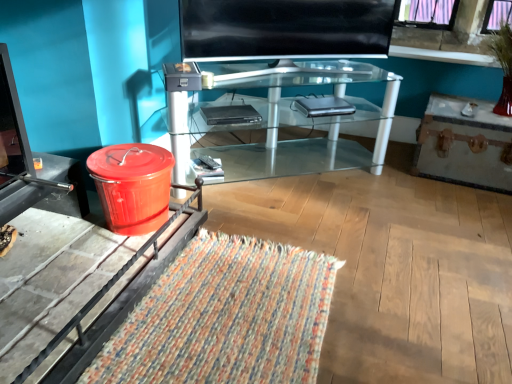
The width and height of the screenshot is (512, 384). I want to click on metallic silver drawer at right, so click(x=464, y=154).

The height and width of the screenshot is (384, 512). What do you see at coordinates (324, 106) in the screenshot?
I see `silver metallic laptop at center, the 2th laptop when ordered from left to right` at bounding box center [324, 106].

Identify the location of silver metallic laptop at center, positioned as the 1th laptop in right-to-left order. (324, 106).

What do you see at coordinates (285, 29) in the screenshot?
I see `black glass screen at center` at bounding box center [285, 29].

What do you see at coordinates (503, 66) in the screenshot?
I see `shiny red vase at upper right` at bounding box center [503, 66].

In order to click on black plastic remote control at center in this screenshot , I will do `click(210, 162)`.

Can you tell me how much shiny plastic trash can at lower left and woven multicolored mat at lower left differ in facing direction?

There is a 0.00157-degree angle between the facing directions of shiny plastic trash can at lower left and woven multicolored mat at lower left.

Does shiny plastic trash can at lower left appear on the right side of woven multicolored mat at lower left?

No.

From a real-world perspective, is shiny plastic trash can at lower left physically above woven multicolored mat at lower left?

Yes.

Is black plastic remote control at center next to black plastic dvd player at center, positioned as the second laptop in right-to-left order, and touching it?

No.

Considering the relative positions of black plastic remote control at center and black plastic dvd player at center, which appears as the first laptop when viewed from the front, in the image provided, is black plastic remote control at center behind black plastic dvd player at center, which appears as the first laptop when viewed from the front,?

Yes, black plastic remote control at center is further from the viewer.

Can you confirm if black plastic remote control at center is taller than black plastic dvd player at center, positioned as the second laptop in right-to-left order?

Incorrect, the height of black plastic remote control at center is not larger of that of black plastic dvd player at center, positioned as the second laptop in right-to-left order.

Considering the relative sizes of black plastic remote control at center and black plastic dvd player at center, positioned as the second laptop in right-to-left order, in the image provided, is black plastic remote control at center bigger than black plastic dvd player at center, positioned as the second laptop in right-to-left order,?

Incorrect, black plastic remote control at center is not larger than black plastic dvd player at center, positioned as the second laptop in right-to-left order.

From a real-world perspective, is shiny red vase at upper right over black glass screen at center?

No, from a real-world perspective, shiny red vase at upper right is not over black glass screen at center

Does shiny red vase at upper right have a smaller size compared to black glass screen at center?

Correct, shiny red vase at upper right occupies less space than black glass screen at center.

Considering the relative sizes of shiny red vase at upper right and black glass screen at center in the image provided, is shiny red vase at upper right wider than black glass screen at center?

Indeed, shiny red vase at upper right has a greater width compared to black glass screen at center.

Can you confirm if shiny red vase at upper right is bigger than black plastic remote control at center?

Yes.

Find the location of a particular element. The height and width of the screenshot is (384, 512). houseplant in front of the black plastic remote control at center is located at coordinates (503, 66).

From a real-world perspective, between shiny red vase at upper right and black plastic remote control at center, who is vertically higher?

In real-world perspective, shiny red vase at upper right is above.

From a real-world perspective, is woven multicolored mat at lower left above or below black plastic remote control at center?

woven multicolored mat at lower left is below black plastic remote control at center.

Is woven multicolored mat at lower left inside the boundaries of black plastic remote control at center, or outside?

woven multicolored mat at lower left is located beyond the bounds of black plastic remote control at center.

Which is more to the left, woven multicolored mat at lower left or black plastic remote control at center?

black plastic remote control at center is more to the left.

Can you confirm if shiny red vase at upper right is smaller than clear glass desk at center?

Indeed, shiny red vase at upper right has a smaller size compared to clear glass desk at center.

Considering the points (490, 36) and (335, 71), which point is behind, point (490, 36) or point (335, 71)?

Point (335, 71)

From a real-world perspective, which is physically below, shiny red vase at upper right or clear glass desk at center?

From a 3D spatial view, clear glass desk at center is below.

Visually, is shiny red vase at upper right positioned to the left or to the right of clear glass desk at center?

Clearly, shiny red vase at upper right is on the right of clear glass desk at center in the image.

Considering the relative positions of black glass screen at center and black plastic dvd player at center, which is the second laptop in back-to-front order, in the image provided, is black glass screen at center to the right of black plastic dvd player at center, which is the second laptop in back-to-front order, from the viewer's perspective?

Indeed, black glass screen at center is positioned on the right side of black plastic dvd player at center, which is the second laptop in back-to-front order.

Looking at this image, can you confirm if black glass screen at center is smaller than black plastic dvd player at center, which appears as the first laptop when viewed from the front?

Incorrect, black glass screen at center is not smaller in size than black plastic dvd player at center, which appears as the first laptop when viewed from the front.

Identify the location of screen that is above the black plastic dvd player at center, which appears as the first laptop when viewed from the front (from a real-world perspective). This screenshot has height=384, width=512. (285, 29).

This screenshot has width=512, height=384. Find the location of `trash bin/can on the left of woven multicolored mat at lower left`. trash bin/can on the left of woven multicolored mat at lower left is located at coordinates (132, 186).

At what (x,y) coordinates should I click in order to perform the action: click on laptop in front of the black plastic remote control at center. Please return your answer as a coordinate pair (x, y). The width and height of the screenshot is (512, 384). Looking at the image, I should click on (230, 115).

Which object lies nearer to the anchor point woven multicolored mat at lower left, clear glass desk at center or silver metallic laptop at center, positioned as the 1th laptop in right-to-left order?

clear glass desk at center is closer to woven multicolored mat at lower left.

From the image, which object appears to be farther from shiny red vase at upper right, black plastic dvd player at center, positioned as the second laptop in right-to-left order, or metallic silver drawer at right?

Among the two, black plastic dvd player at center, positioned as the second laptop in right-to-left order, is located further to shiny red vase at upper right.

Based on their spatial positions, is woven multicolored mat at lower left or black glass screen at center closer to shiny red vase at upper right?

black glass screen at center is positioned closer to the anchor shiny red vase at upper right.

Based on their spatial positions, is woven multicolored mat at lower left or black glass screen at center further from metallic silver drawer at right?

Based on the image, woven multicolored mat at lower left appears to be further to metallic silver drawer at right.

Which object lies nearer to the anchor point black glass screen at center, silver metallic laptop at center, positioned as the 1th laptop in right-to-left order, or shiny plastic trash can at lower left?

silver metallic laptop at center, positioned as the 1th laptop in right-to-left order, lies closer to black glass screen at center than the other object.

Which object lies nearer to the anchor point clear glass desk at center, black plastic dvd player at center, which appears as the first laptop when viewed from the front, or black plastic remote control at center?

The object closer to clear glass desk at center is black plastic dvd player at center, which appears as the first laptop when viewed from the front.

Which object lies further to the anchor point black glass screen at center, metallic silver drawer at right or woven multicolored mat at lower left?

woven multicolored mat at lower left.

Based on their spatial positions, is shiny red vase at upper right or silver metallic laptop at center, positioned as the 1th laptop in right-to-left order, further from metallic silver drawer at right?

silver metallic laptop at center, positioned as the 1th laptop in right-to-left order, is further to metallic silver drawer at right.

Where is `screen located between clear glass desk at center and silver metallic laptop at center, arranged as the 1th laptop when viewed from the back, in the depth direction`? screen located between clear glass desk at center and silver metallic laptop at center, arranged as the 1th laptop when viewed from the back, in the depth direction is located at coordinates (285, 29).

The width and height of the screenshot is (512, 384). In order to click on desk between black glass screen at center and woven multicolored mat at lower left in the vertical direction in this screenshot , I will do (280, 118).

You are a GUI agent. You are given a task and a screenshot of the screen. Output one action in this format:
    pyautogui.click(x=<x>, y=<y>)
    Task: Click on the laptop between black plastic dvd player at center, which is counted as the first laptop, starting from the left, and shiny red vase at upper right from left to right
    
    Given the screenshot: What is the action you would take?
    pyautogui.click(x=324, y=106)

The height and width of the screenshot is (384, 512). Identify the location of desk situated between shiny plastic trash can at lower left and metallic silver drawer at right from left to right. (280, 118).